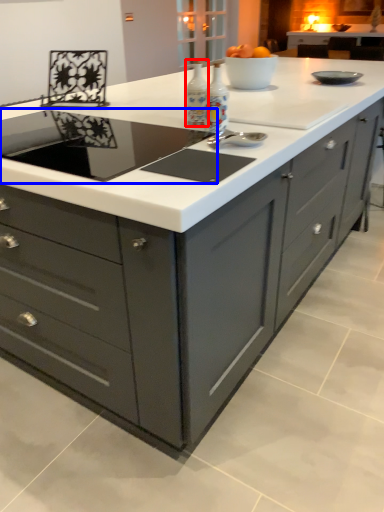
Question: Which object is further to the camera taking this photo, appliance (highlighted by a red box) or home appliance (highlighted by a blue box)?

Choices:
 (A) appliance
 (B) home appliance

Answer: (A)